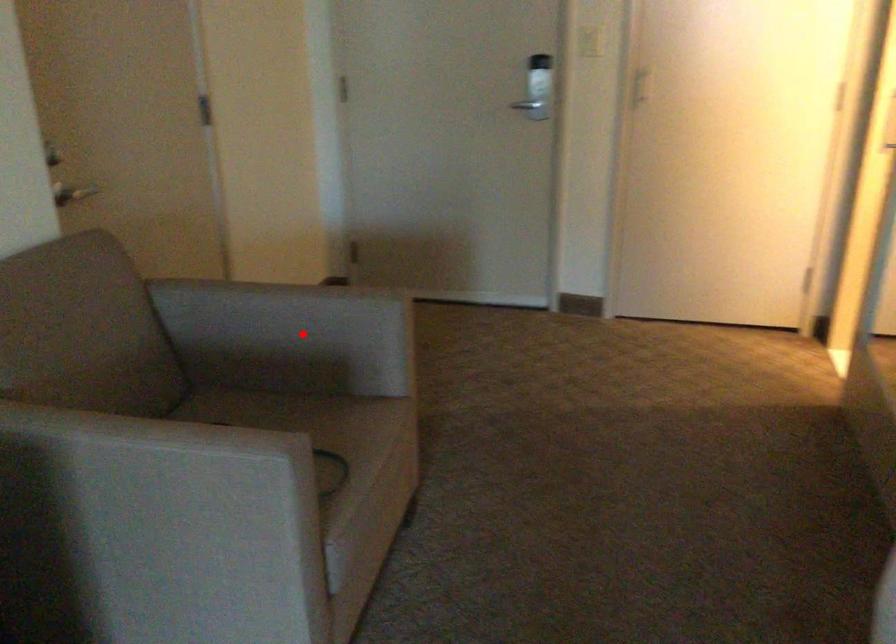
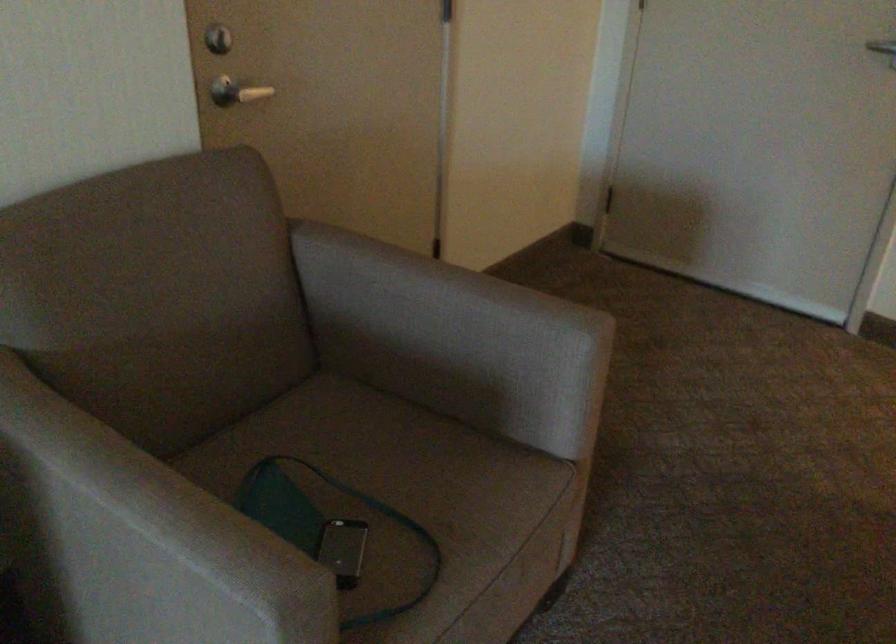
Question: I am providing you with two images of the same scene from different viewpoints. A red point is shown in image1. For the corresponding object point in image2, is it positioned nearer or farther from the camera?

Choices:
 (A) Nearer
 (B) Farther

Answer: (A)